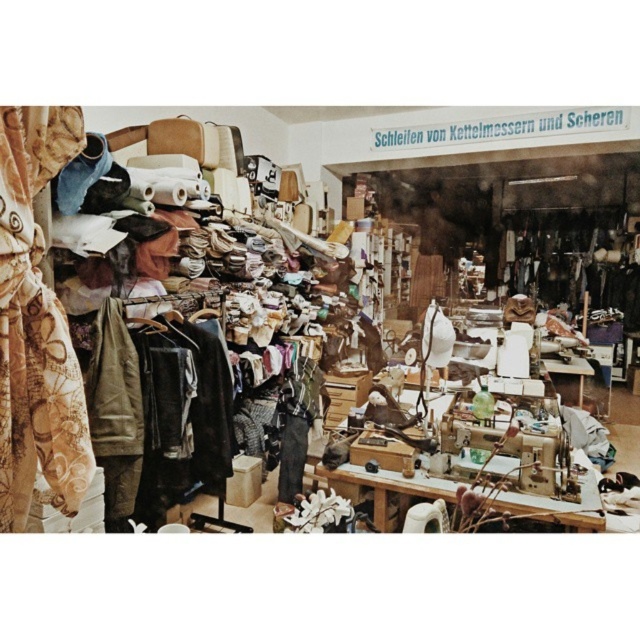
Question: Is textured fabric jackets at left thinner than leather jacket at center?

Choices:
 (A) no
 (B) yes

Answer: (A)

Question: Which object is positioned closest to the leather jacket at center?

Choices:
 (A) beige floral fabric at left
 (B) textured fabric jackets at left

Answer: (B)

Question: Is the position of textured fabric jackets at left more distant than that of leather jacket at center?

Choices:
 (A) yes
 (B) no

Answer: (B)

Question: Based on their relative distances, which object is farther from the beige floral fabric at left?

Choices:
 (A) leather jacket at center
 (B) textured fabric jackets at left

Answer: (A)

Question: Does beige floral fabric at left appear on the right side of leather jacket at center?

Choices:
 (A) yes
 (B) no

Answer: (B)

Question: Estimate the real-world distances between objects in this image. Which object is farther from the leather jacket at center?

Choices:
 (A) textured fabric jackets at left
 (B) beige floral fabric at left

Answer: (B)